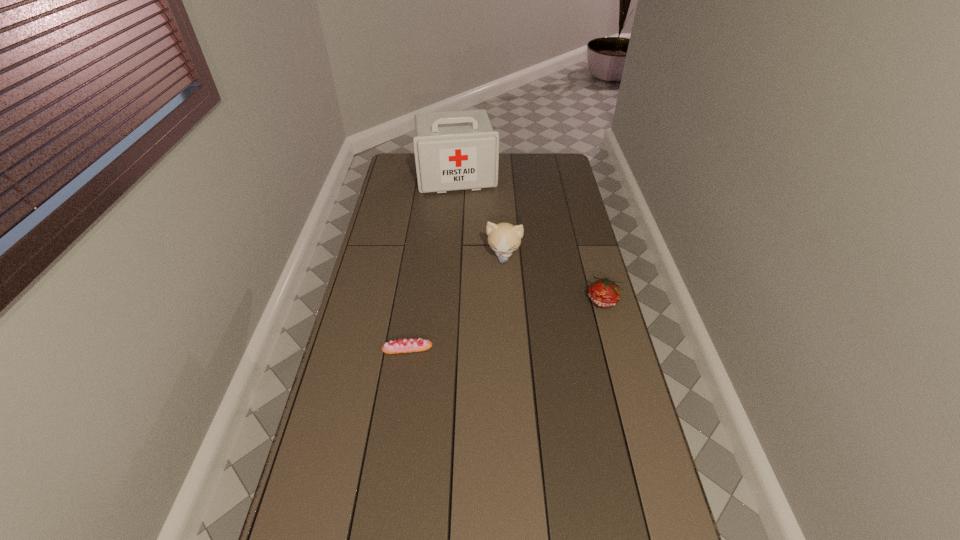
Where is `the shortest object`? Image resolution: width=960 pixels, height=540 pixels. the shortest object is located at coordinates (413, 345).

Find the location of a particular element. This screenshot has height=540, width=960. the nearest object is located at coordinates tap(413, 345).

What are the coordinates of `the second shortest object` in the screenshot? It's located at (603, 292).

Locate an element on the screen. This screenshot has width=960, height=540. tomato is located at coordinates (603, 292).

The height and width of the screenshot is (540, 960). I want to click on kitten, so click(504, 238).

Find the location of a particular element. This screenshot has height=540, width=960. the third nearest object is located at coordinates (504, 238).

At what (x,y) coordinates should I click in order to perform the action: click on the tallest object. Please return your answer as a coordinate pair (x, y). Looking at the image, I should click on (457, 150).

This screenshot has height=540, width=960. In order to click on the farthest object in this screenshot , I will do `click(457, 150)`.

Where is `blank space located on the back of the nearest object`? This screenshot has height=540, width=960. blank space located on the back of the nearest object is located at coordinates (415, 299).

This screenshot has height=540, width=960. I want to click on free spot located 0.390m on the front-facing side of the rightmost object, so click(635, 415).